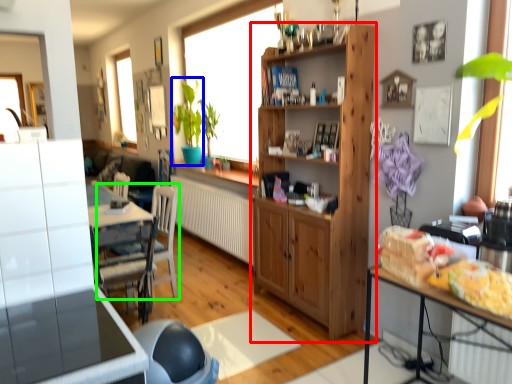
Question: Based on their relative distances, which object is farther from cabinetry (highlighted by a red box)? Choose from plant (highlighted by a blue box) and chair (highlighted by a green box).

Choices:
 (A) plant
 (B) chair

Answer: (A)